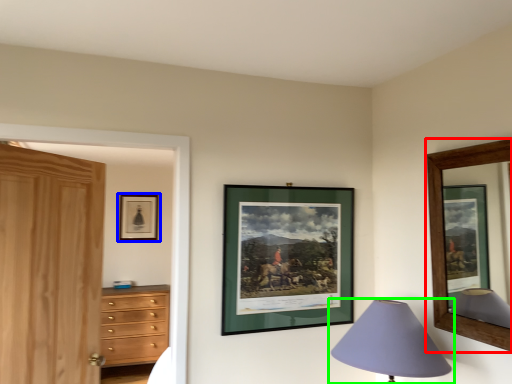
Question: Which object is the closest to the picture frame (highlighted by a red box)? Choose among these: picture frame (highlighted by a blue box) or lamp (highlighted by a green box).

Choices:
 (A) picture frame
 (B) lamp

Answer: (B)